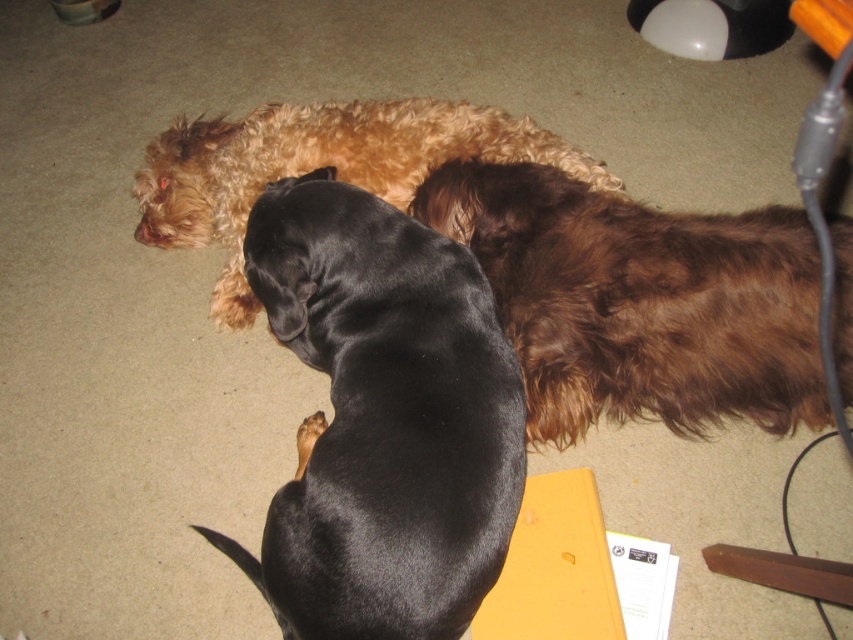
You are standing at the center of the image and want to locate the black shiny dog at center. What are its coordinates?

The black shiny dog at center is located at coordinates point (383, 420).

You are a photographer standing 5 feet away from the black shiny dog at center. You want to take a closeup photo of it. Can you move closer to get a better shot without exceeding the maximum distance of 4 feet?

The black shiny dog at center is currently 3.78 feet away from the camera. Since you are standing 5 feet away, you can move 1.22 feet closer to reach the 4 feet maximum distance limit and take the closeup photo.

You are a photographer trying to capture a closeup of the black Dachshund in the foreground. You have two points marked in the image for focus. Point A is at coordinates point (247,266) and Point B is at point (656,416). Which point should you choose to ensure the black Dachshund is in focus?

Point A at point (247,266) is closer to the viewer than point (656,416), so choosing Point A will ensure the black Dachshund in the foreground is in focus.